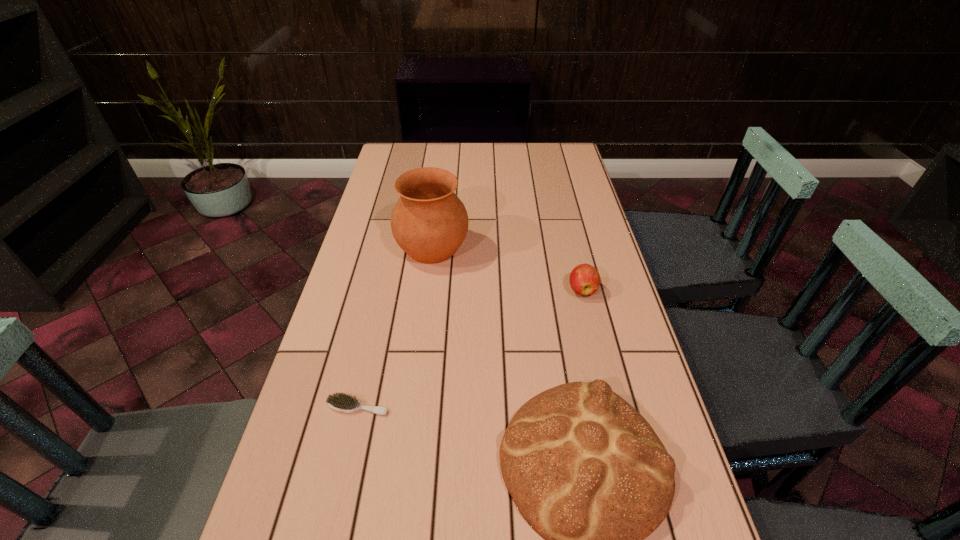
Identify the location of blank space that satisfies the following two spatial constraints: 1. on the front side of the tallest object; 2. on the right side of the apple. This screenshot has width=960, height=540. (427, 290).